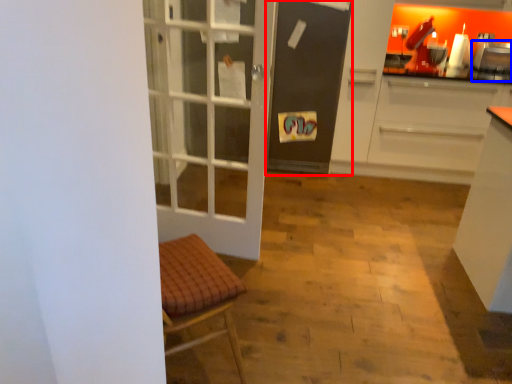
Question: Which point is closer to the camera, screen door (highlighted by a red box) or appliance (highlighted by a blue box)?

Choices:
 (A) screen door
 (B) appliance

Answer: (A)